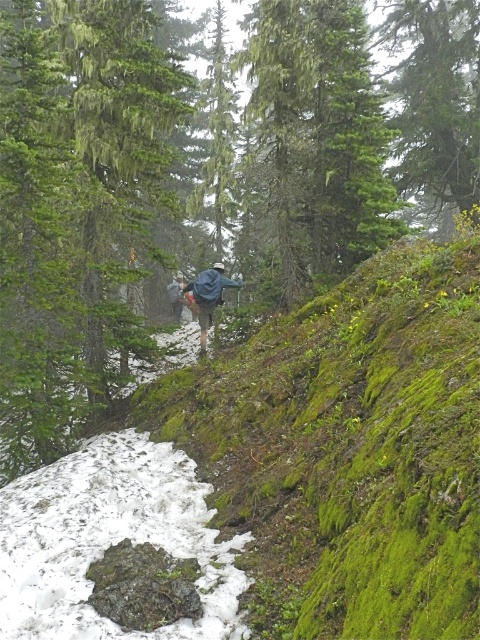
You are a hiker planning to cross the trail in the image. You notice the white powdery snow at lower left and the blue denim jacket at center. Which object takes up more space in the image?

The white powdery snow at lower left takes up more space in the image than the blue denim jacket at center because it is larger in size.

You are a hiker planning to cross the trail in the image. You notice the white powdery snow at lower left and the blue fabric backpack at center. Which object is taller?

The blue fabric backpack at center is taller than the white powdery snow at lower left.